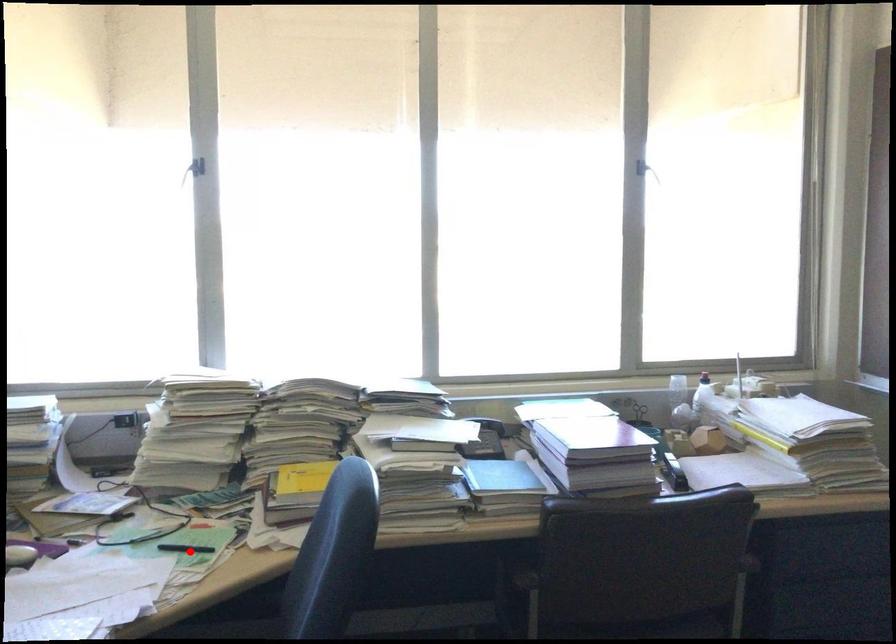
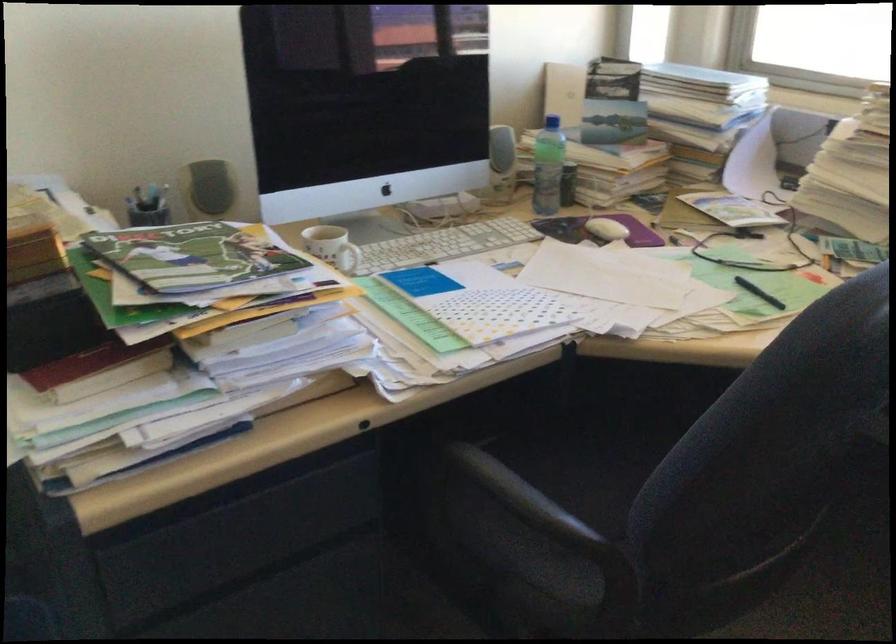
Question: I am providing you with two images of the same scene from different viewpoints. A red point is marked on the first image. At the location where the point appears in image 1, is it still visible in image 2?

Choices:
 (A) Yes
 (B) No

Answer: (A)